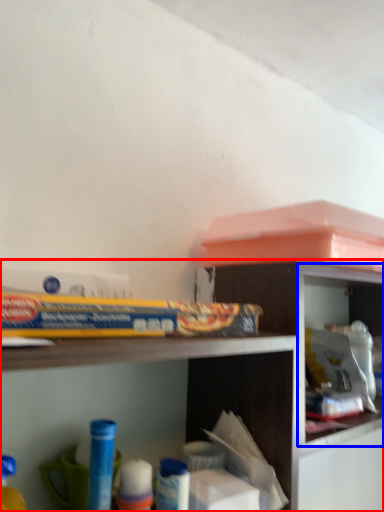
Question: Which object appears farthest to the camera in this image, shelf (highlighted by a red box) or cabinet (highlighted by a blue box)?

Choices:
 (A) shelf
 (B) cabinet

Answer: (B)